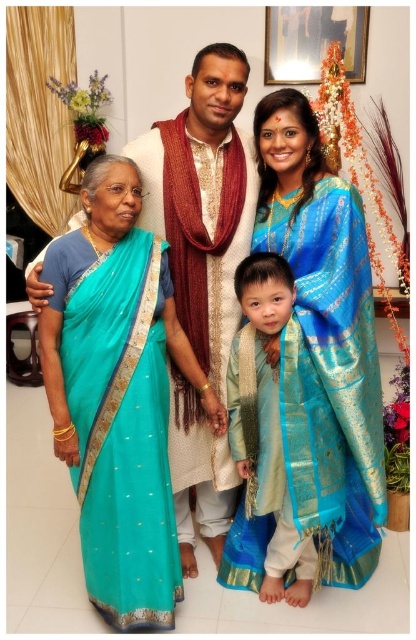
You are a photographer setting up for a family portrait. You need to ensure that the teal silk saree at left and the blue silk saree at center are spaced exactly 24 inches apart for the composition. Based on the current setup, will you need to adjust their positions?

The current distance between the teal silk saree at left and the blue silk saree at center is 21.89 inches. Since this is less than the required 24 inches, you should move them further apart to achieve the desired spacing.

You are a photographer arranging a family portrait. You need to ensure that the teal silk saree at left and the silk blue kurta at center are both visible in the photo. Based on their positions, which one is closer to the camera?

The teal silk saree at left is in front of the silk blue kurta at center, so it is closer to the camera.

You are standing in the living room where the family portrait is displayed. You notice a point marked at coordinates [331,378]. Based on the scene description provided, which object does this point correspond to?

The point [331,378] corresponds to the blue silk saree at center.